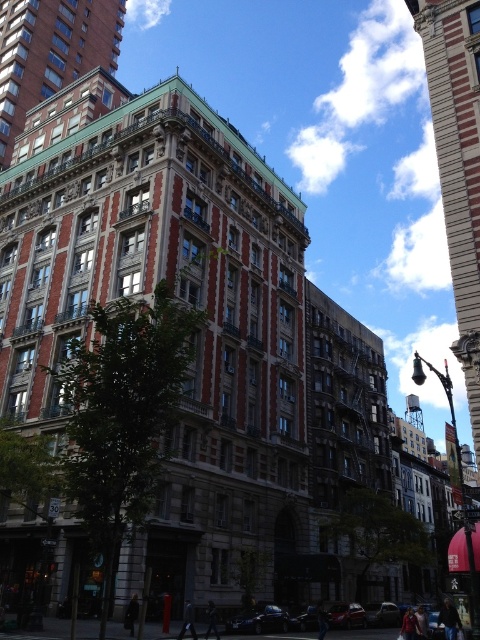
Between brown stone building at center and stone textured building at right, which one appears on the right side from the viewer's perspective?

stone textured building at right is more to the right.

Is brown stone building at center above stone textured building at right?

Yes.

Image resolution: width=480 pixels, height=640 pixels. I want to click on brown stone building at center, so click(x=177, y=298).

Is point (453, 58) behind point (0, 154)?

That is False.

Between point (436, 100) and point (66, 80), which one is positioned behind?

The point (66, 80) is behind.

Does point (439, 115) lie in front of point (87, 45)?

That is True.

I want to click on stone textured building at right, so click(457, 163).

Based on the photo, between brown stone building at center and red brick building at upper left, which one is positioned lower?

brown stone building at center is lower down.

Is brown stone building at center smaller than red brick building at upper left?

Actually, brown stone building at center might be larger than red brick building at upper left.

Does point (126, 216) lie in front of point (15, 58)?

Yes, it is in front of point (15, 58).

Locate an element on the screen. This screenshot has width=480, height=640. brown stone building at center is located at coordinates (177, 298).